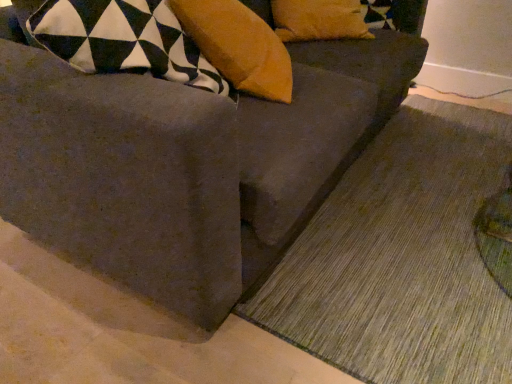
The width and height of the screenshot is (512, 384). I want to click on free space underneath green textured mat at lower right (from a real-world perspective), so click(437, 204).